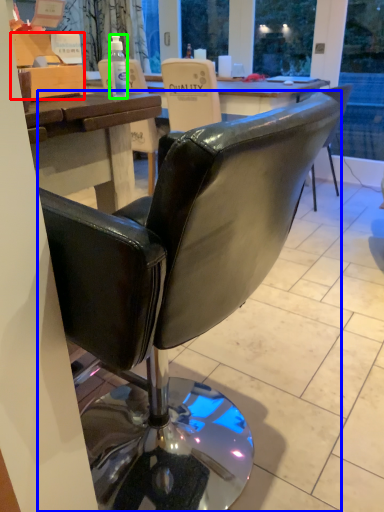
Question: Which object is positioned farthest from box (highlighted by a red box)? Select from chair (highlighted by a blue box) and bottle (highlighted by a green box).

Choices:
 (A) chair
 (B) bottle

Answer: (A)